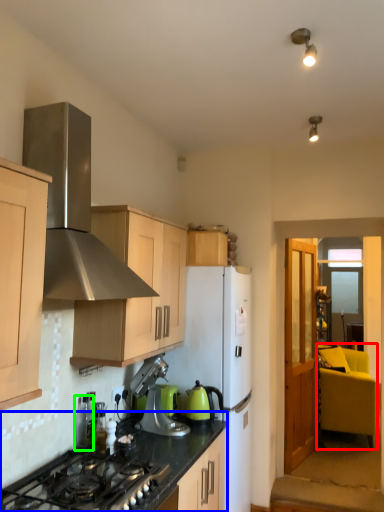
Question: Which object is positioned closest to armchair (highlighted by a red box)? Select from countertop (highlighted by a blue box) and appliance (highlighted by a green box).

Choices:
 (A) countertop
 (B) appliance

Answer: (A)